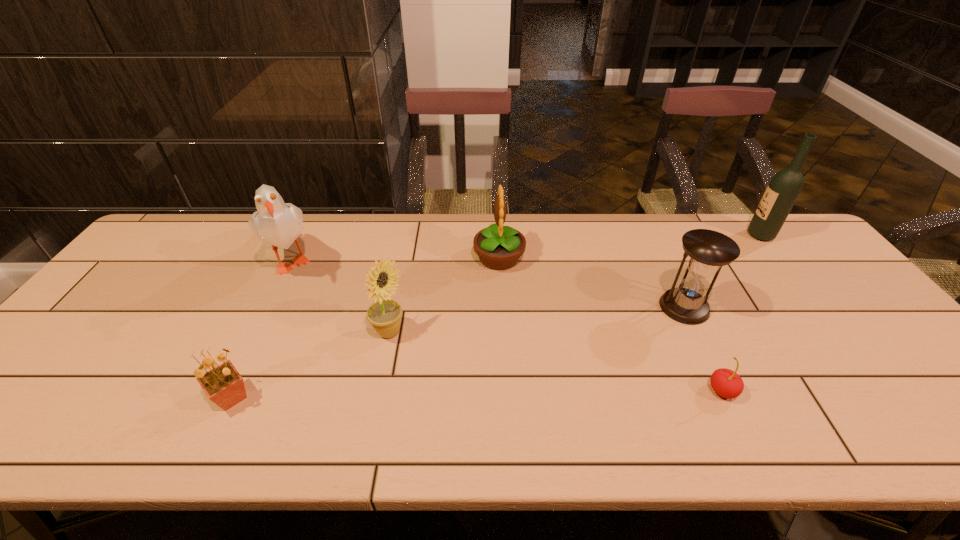
I want to click on vacant region that satisfies the following two spatial constraints: 1. on the back side of the shortest object; 2. on the right side of the hourglass, so click(683, 307).